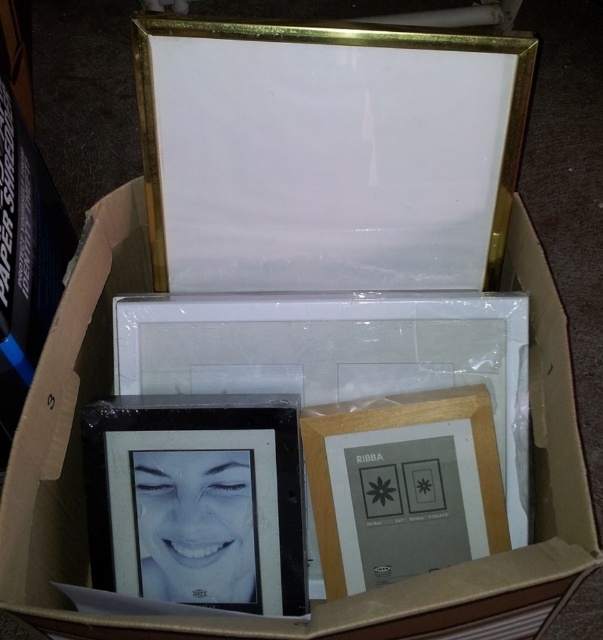
You are trying to stack the matte white cardboard box at center and the black glossy photo frame at lower left. Which object should be placed at the bottom to ensure stability?

The matte white cardboard box at center is much taller than the black glossy photo frame at lower left, so placing the taller box at the bottom would provide a stable base.